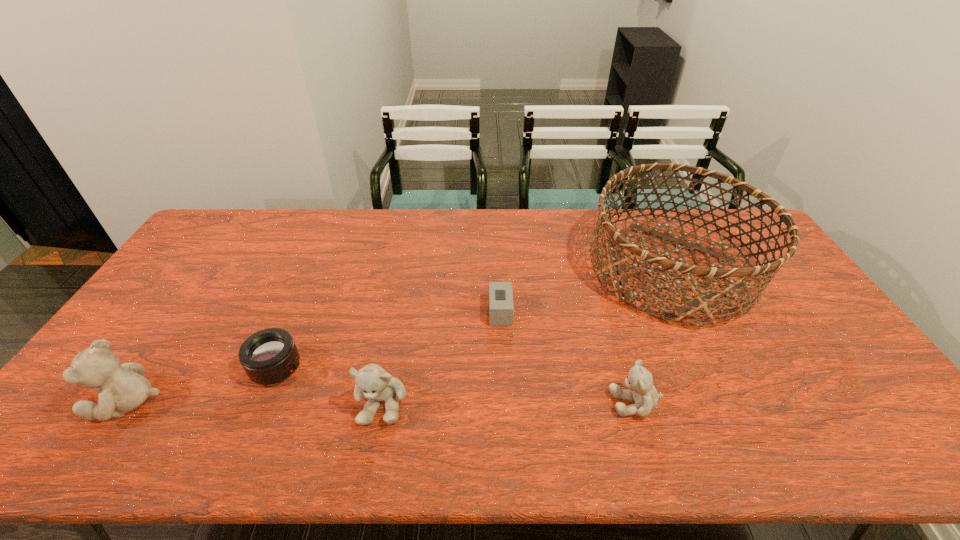
You are a GUI agent. You are given a task and a screenshot of the screen. Output one action in this format:
    pyautogui.click(x=<x>, y=<y>)
    Task: Click on the object positioned at the left edge
    The width and height of the screenshot is (960, 540).
    Given the screenshot: What is the action you would take?
    pyautogui.click(x=122, y=388)

What are the coordinates of `object that is at the right edge` in the screenshot? It's located at (702, 297).

Locate an element on the screen. Image resolution: width=960 pixels, height=540 pixels. object located at the near left corner is located at coordinates (122, 388).

The image size is (960, 540). What are the coordinates of `object positioned at the far right corner` in the screenshot? It's located at (702, 297).

The width and height of the screenshot is (960, 540). Identify the location of vacant area at the far edge. (298, 222).

Find the location of a particular element. The height and width of the screenshot is (540, 960). vacant space at the near edge of the desktop is located at coordinates coord(782,399).

The image size is (960, 540). I want to click on blank area at the left edge, so click(180, 338).

I want to click on vacant area at the right edge, so click(840, 362).

Where is `vacant region at the far left corner`? This screenshot has height=540, width=960. vacant region at the far left corner is located at coordinates (213, 225).

Where is `vacant space that's between the alarm clock and the leftmost object`? The width and height of the screenshot is (960, 540). vacant space that's between the alarm clock and the leftmost object is located at coordinates (315, 356).